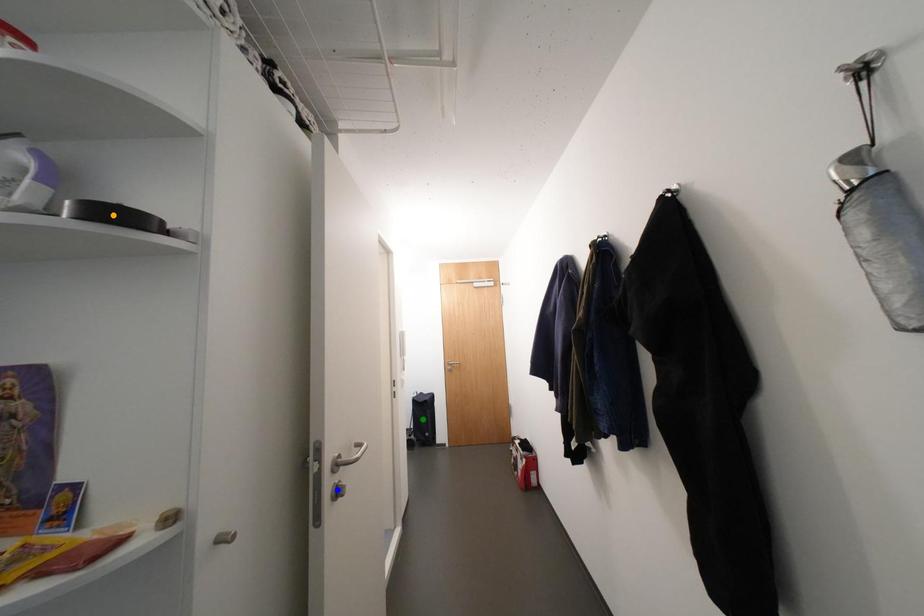
Order these from nearest to farthest:
1. green point
2. orange point
3. blue point

orange point < blue point < green point